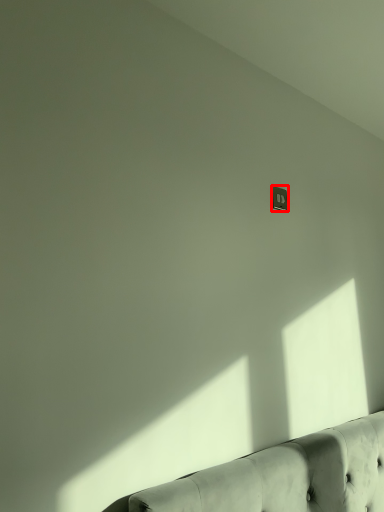
Question: In this image, where is electric outlet (annotated by the red box) located relative to studio couch?

Choices:
 (A) left
 (B) right

Answer: (A)